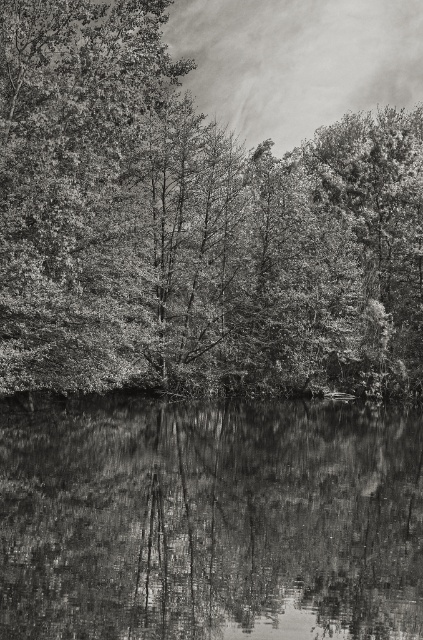
Question: Can you confirm if smooth bark tree at upper center is smaller than smooth reflective water at bottom?

Choices:
 (A) yes
 (B) no

Answer: (B)

Question: Is smooth bark tree at upper center positioned in front of smooth reflective water at bottom?

Choices:
 (A) no
 (B) yes

Answer: (A)

Question: From the image, what is the correct spatial relationship of smooth bark tree at upper center in relation to smooth reflective water at bottom?

Choices:
 (A) above
 (B) below

Answer: (A)

Question: Which of the following is the farthest from the observer?

Choices:
 (A) (85, 522)
 (B) (32, 323)

Answer: (B)